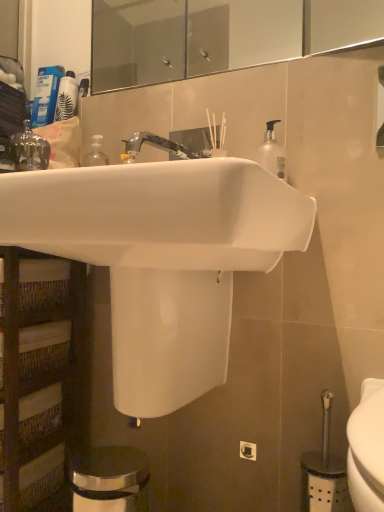
Question: Which is correct: woven wood shelf at left is inside white glossy sink at center, or outside of it?

Choices:
 (A) inside
 (B) outside

Answer: (B)

Question: Considering the positions of woven wood shelf at left and white glossy sink at center in the image, is woven wood shelf at left taller or shorter than white glossy sink at center?

Choices:
 (A) tall
 (B) short

Answer: (A)

Question: Estimate the real-world distances between objects in this image. Which object is farther from the gold metallic crown at upper left?

Choices:
 (A) compact blue lotion at upper left
 (B) white glossy sink at center
 (C) woven wood shelf at left

Answer: (B)

Question: Which object is the farthest from the compact blue lotion at upper left?

Choices:
 (A) woven wood shelf at left
 (B) gold metallic crown at upper left
 (C) white glossy sink at center

Answer: (C)